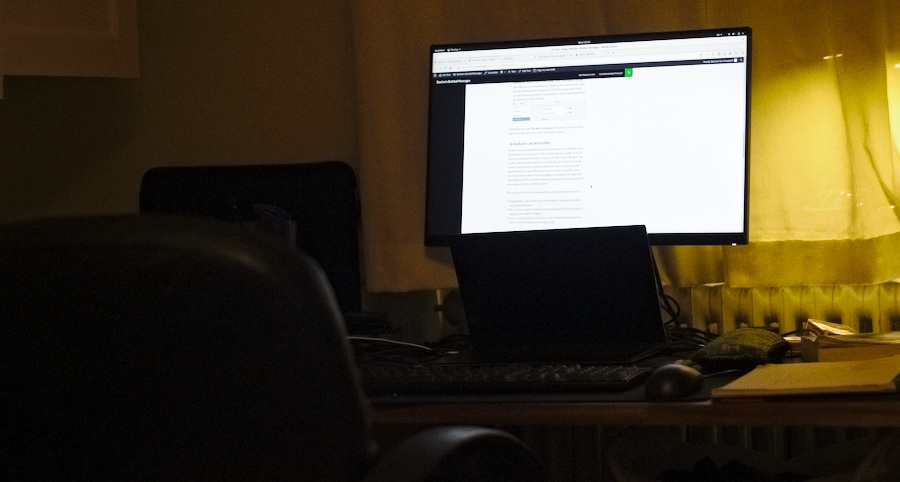
You are a GUI agent. You are given a task and a screenshot of the screen. Output one action in this format:
    pyautogui.click(x=<x>, y=<y>)
    Task: Click on the mouse
    The height and width of the screenshot is (482, 900).
    Given the screenshot: What is the action you would take?
    pyautogui.click(x=659, y=381)